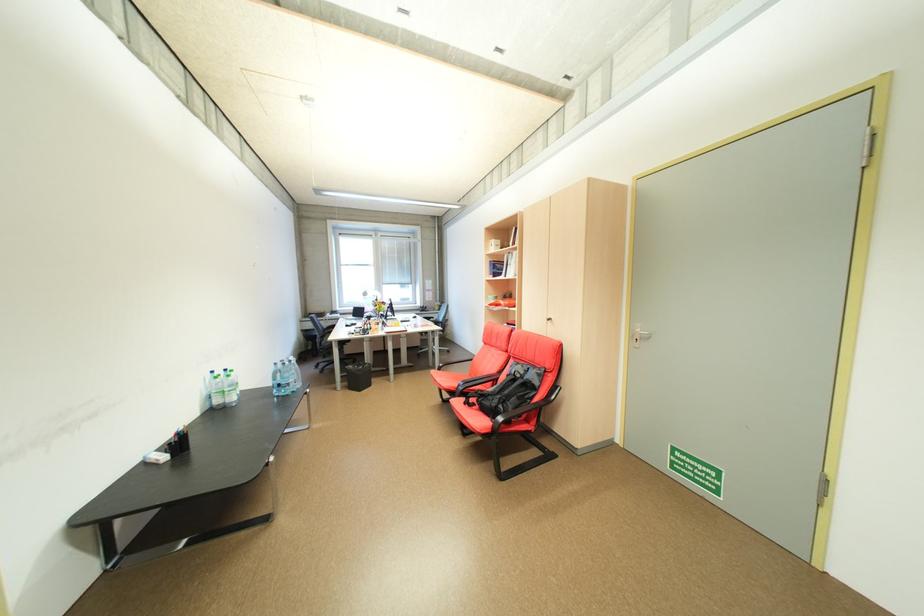
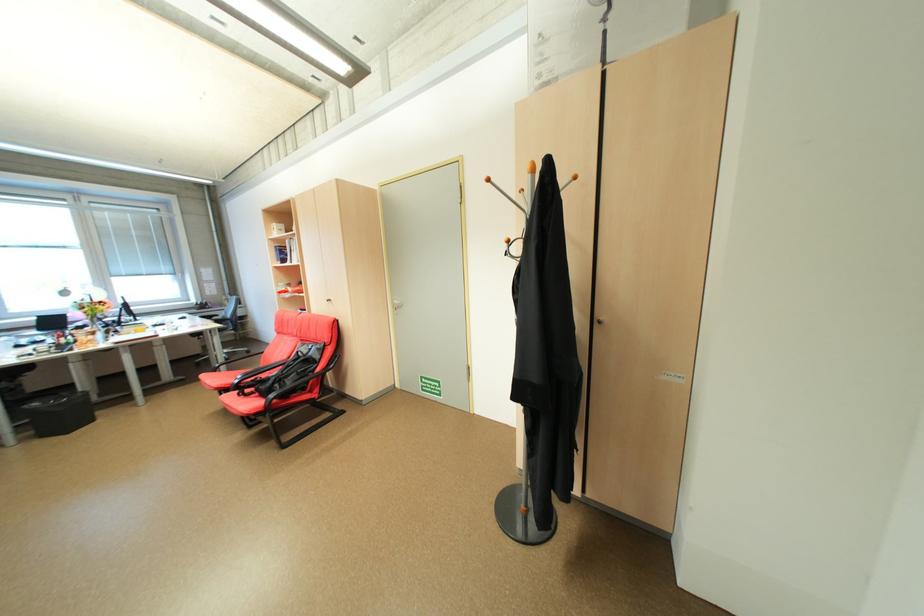
The point at [457,352] is marked in the first image. Where is the corresponding point in the second image?

(257, 353)